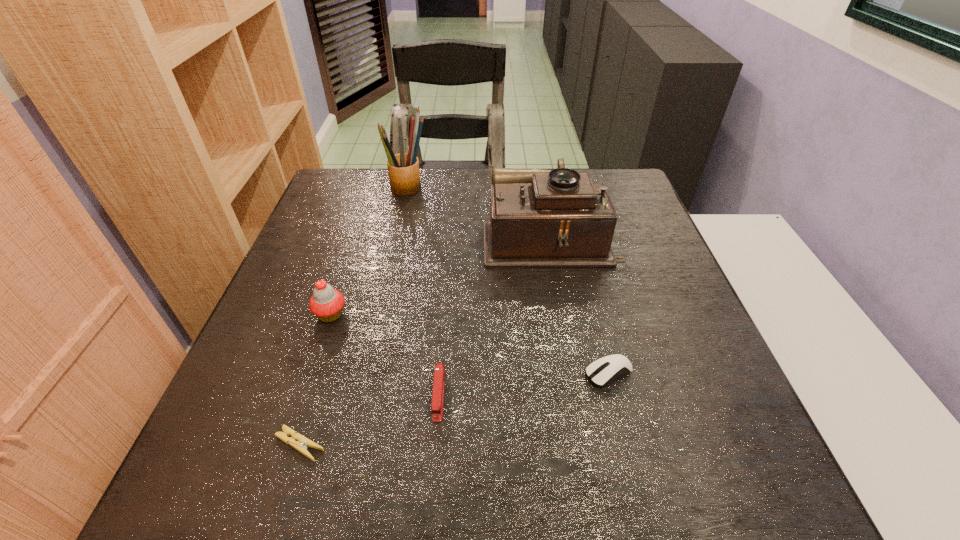
Find the location of a particular element. The image size is (960, 540). unoccupied position between the cupcake and the mouse is located at coordinates (469, 344).

This screenshot has height=540, width=960. I want to click on object that can be found as the third closest to the fifth tallest object, so click(x=301, y=446).

Select which object is the fourth closest to the phonograph_record. Please provide its 2D coordinates. Your answer should be formatted as a tuple, i.e. [(x, y)], where the tuple contains the x and y coordinates of a point satisfying the conditions above.

[(326, 303)]

Where is `vacant space that satisfies the following two spatial constraints: 1. on the horn of the second farthest object; 2. on the front-facing side of the third object from right to left`? vacant space that satisfies the following two spatial constraints: 1. on the horn of the second farthest object; 2. on the front-facing side of the third object from right to left is located at coordinates (580, 395).

Locate an element on the screen. vacant point that satisfies the following two spatial constraints: 1. on the front side of the clothespin; 2. on the left side of the fourth shortest object is located at coordinates (288, 444).